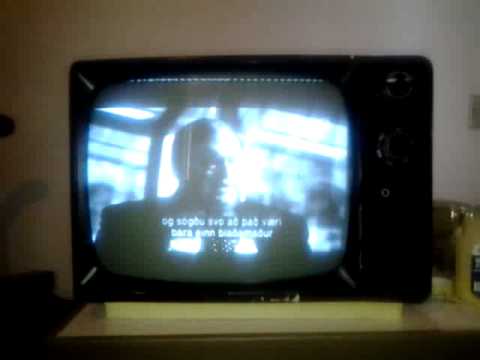
Find the location of a particular element. knobs is located at coordinates (397, 152), (391, 82).